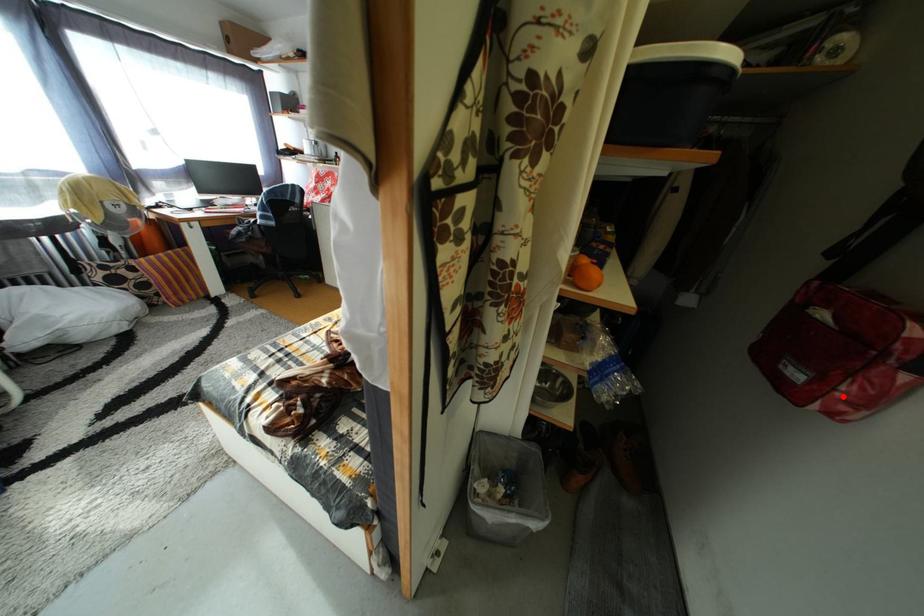
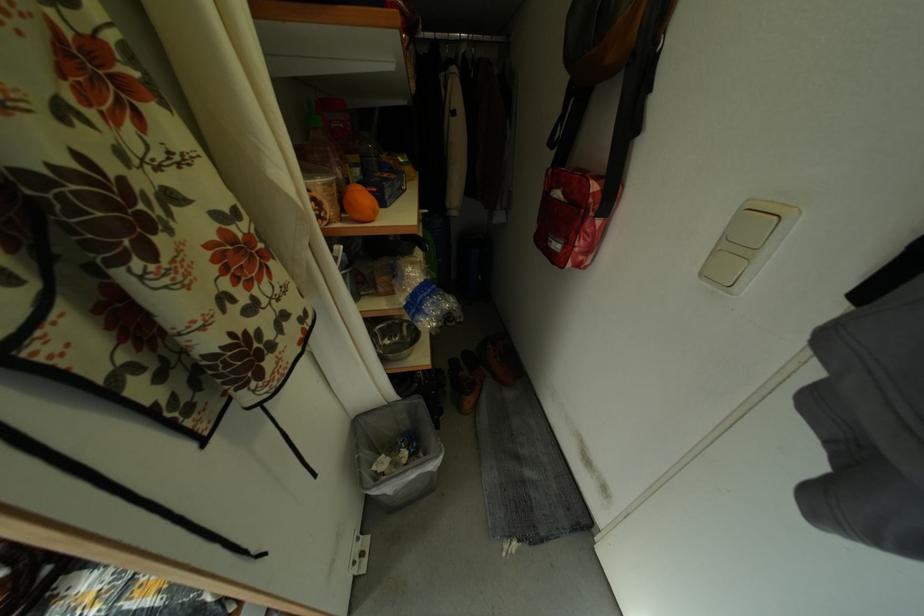
Locate, in the second image, the point that corresponds to the highlighted location in the first image.

(584, 253)